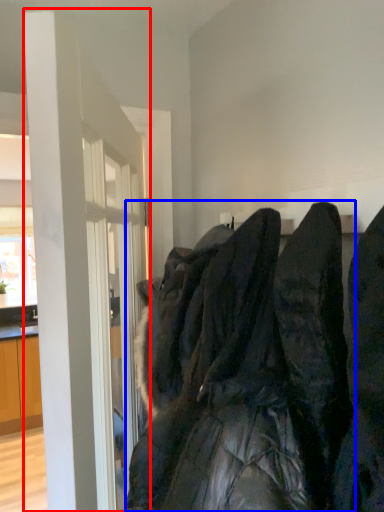
Question: Among these objects, which one is farthest to the camera, door (highlighted by a red box) or laundry (highlighted by a blue box)?

Choices:
 (A) door
 (B) laundry

Answer: (A)